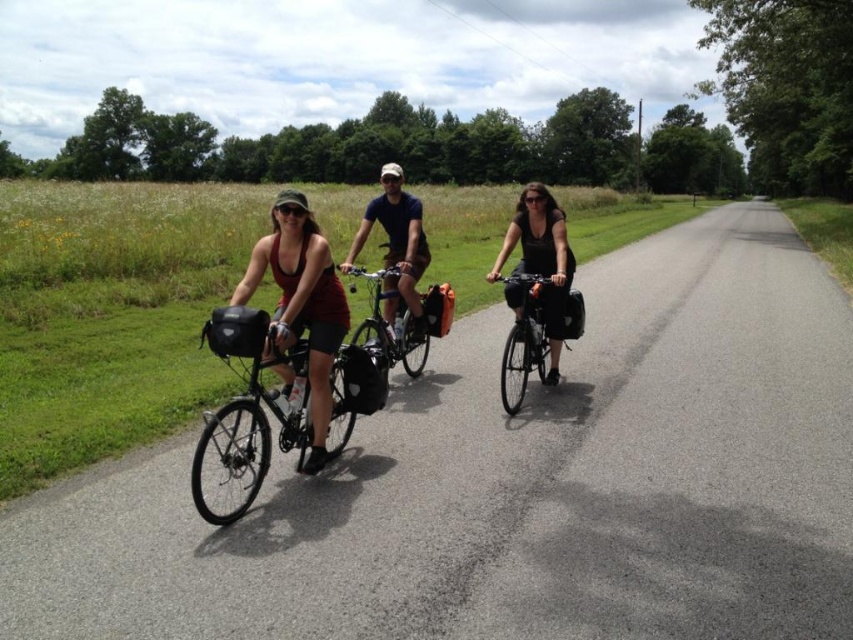
You are a photographer trying to capture the cyclists. You want to focus on the matte red tank top at center. Where should you aim your camera relative to the other cyclists?

The matte red tank top at center is located at point 0.473 along the horizontal axis and 0.355 along the vertical axis, so you should aim your camera slightly to the right and lower than the center of the image to capture the matte red tank top at center accurately.